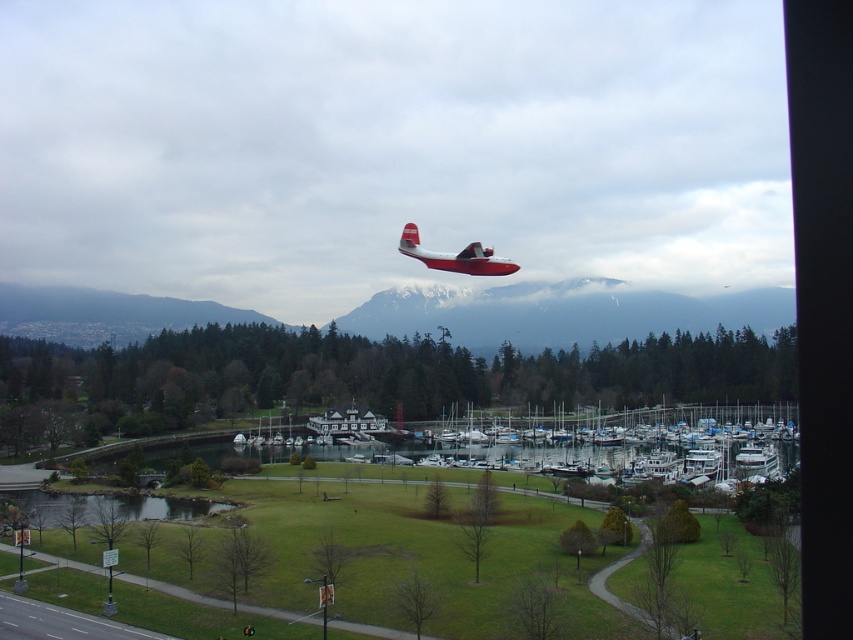
You are a photographer planning to take a wide shot of the snowy mountain at center and the red matte seaplane at center. Based on the scene description, which object will occupy more space in your photo?

The snowy mountain at center is larger in size than the red matte seaplane at center, so it will occupy more space in the photo.

You are a tourist standing at the marina and want to take a photo of both the snowy mountain at center and the red matte seaplane at center. Which object should you position to your left to include both in the frame?

You should position the snowy mountain at center to your left since it is to the right of the red matte seaplane at center, so placing the mountain on your left will ensure both are in the frame.